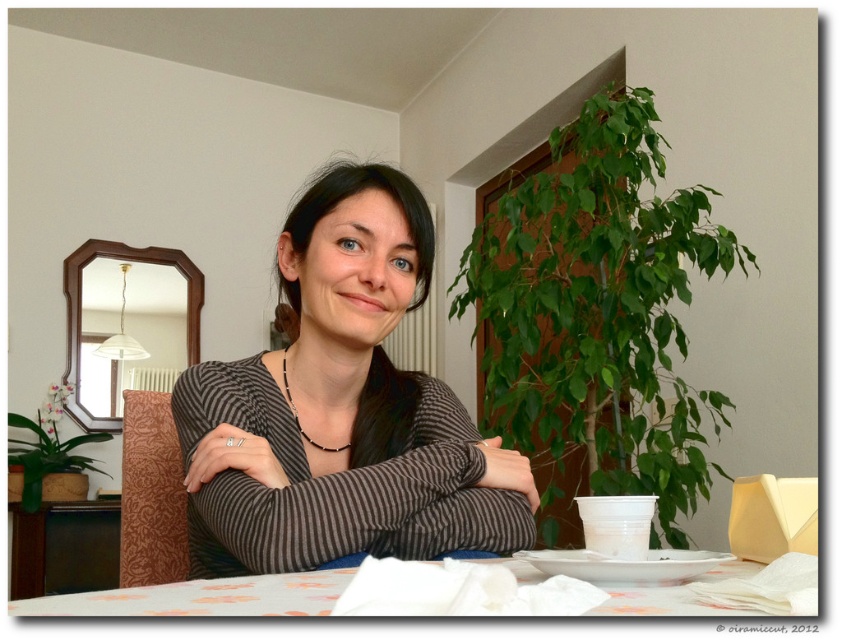
You are a delivery person who needs to place a small package on the table without disturbing the items already there. The package is 10 inches long. Can you fit it between the brown striped sweater at center and the white fabric table at lower center?

The distance between the brown striped sweater at center and the white fabric table at lower center is 10.02 inches, so the package can be placed there as it is slightly wider than the package.

You are standing in the dining area and want to place a small decoration between the two points marked as point (301, 224) and point (158, 592) on the table. Which point should you move towards to place the decoration closer to the viewer?

You should move towards point (301, 224) because it is closer to the viewer compared to point (158, 592).